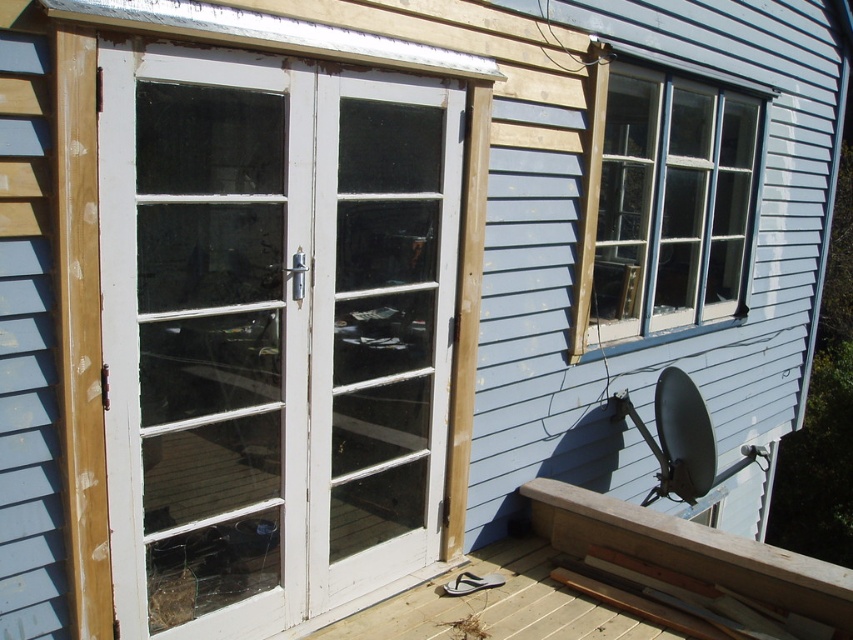
Who is taller, white wood screen door at center or white wood door at center?

white wood screen door at center

Based on the photo, does white wood screen door at center appear on the right side of white wood door at center?

Incorrect, white wood screen door at center is not on the right side of white wood door at center.

Who is more forward, (223,572) or (438,472)?

Positioned in front is point (223,572).

At what (x,y) coordinates should I click in order to perform the action: click on white wood screen door at center. Please return your answer as a coordinate pair (x, y). This screenshot has height=640, width=853. Looking at the image, I should click on (271, 332).

Which is in front, point (439, 339) or point (672, 112)?

Point (439, 339) is more forward.

The height and width of the screenshot is (640, 853). I want to click on white wood door at center, so click(x=381, y=330).

Which is in front, point (352, 157) or point (676, 220)?

Positioned in front is point (352, 157).

The width and height of the screenshot is (853, 640). I want to click on white wood door at center, so click(x=381, y=330).

What are the coordinates of `white wood screen door at center` in the screenshot? It's located at (271, 332).

Consider the image. Is white wood screen door at center shorter than clear glass window at upper right?

No.

This screenshot has height=640, width=853. I want to click on white wood screen door at center, so click(271, 332).